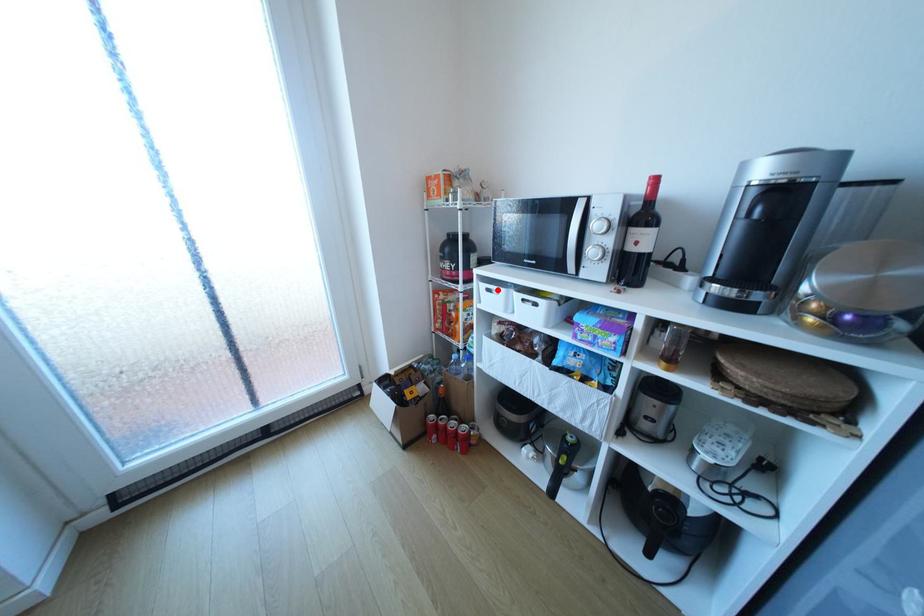
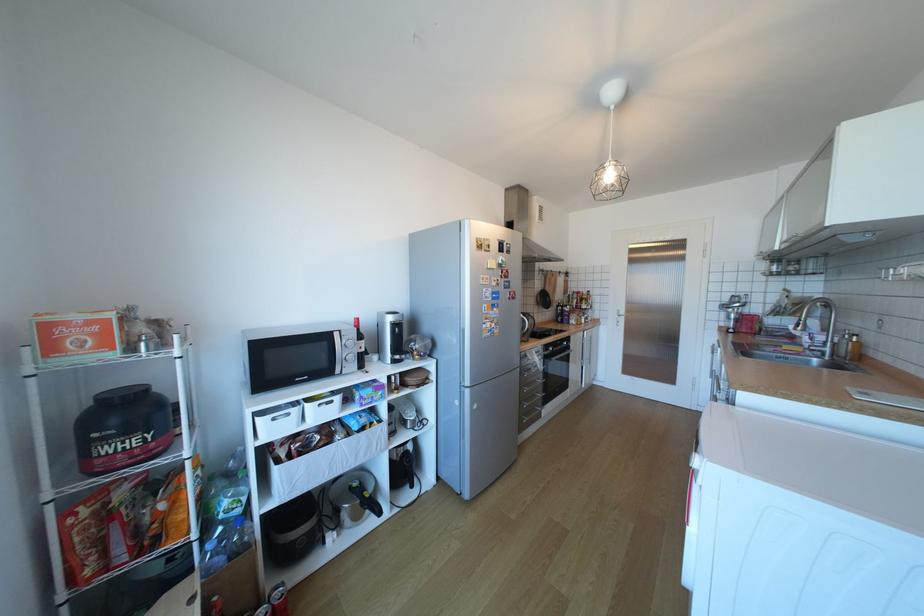
Where in the second image is the point corresponding to the highlighted location from the first image?

(283, 419)